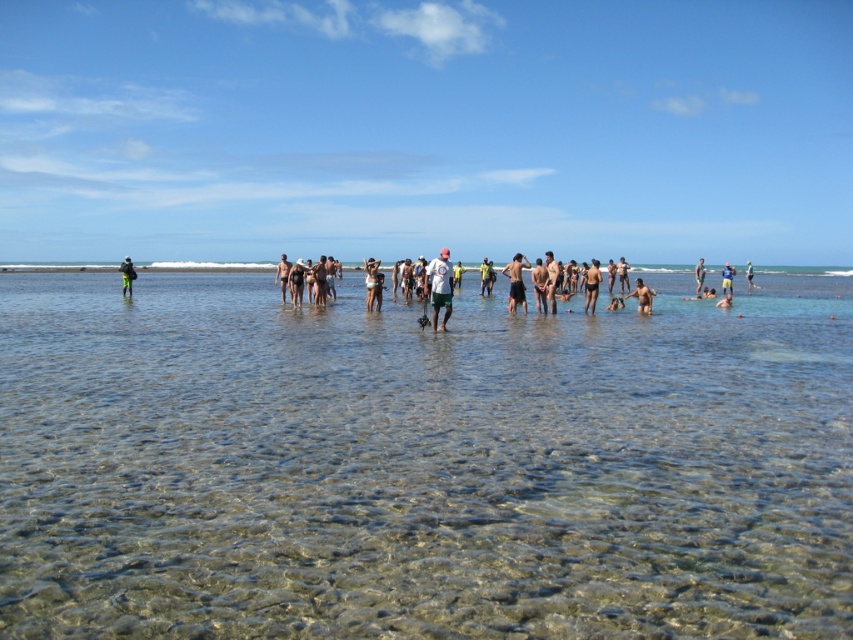
You are a photographer trying to capture a candid shot of the tan skin human at center and the matte black swimsuit at center. Since the camera can only focus on one subject at a time, which one should you aim for to ensure the other is still in the frame?

You should aim for the tan skin human at center because the matte black swimsuit at center is to the left of tan skin human at center, so focusing on the human ensures the swimsuit remains in the frame to the left.

You are a photographer taking a picture of the beach scene. You notice the matte black swimsuit at center and the smooth tan skin at center in your frame. Which object is positioned lower in the image?

The matte black swimsuit at center is located below smooth tan skin at center, so it is positioned lower in the image.

You are a photographer trying to capture a closeup of the matte black swimsuit at center and the smooth tan skin at center. Which object should you zoom in on first to ensure it appears larger in your photo?

The matte black swimsuit at center is shorter than smooth tan skin at center, so you should zoom in on the smooth tan skin at center first to ensure it appears larger in the photo.